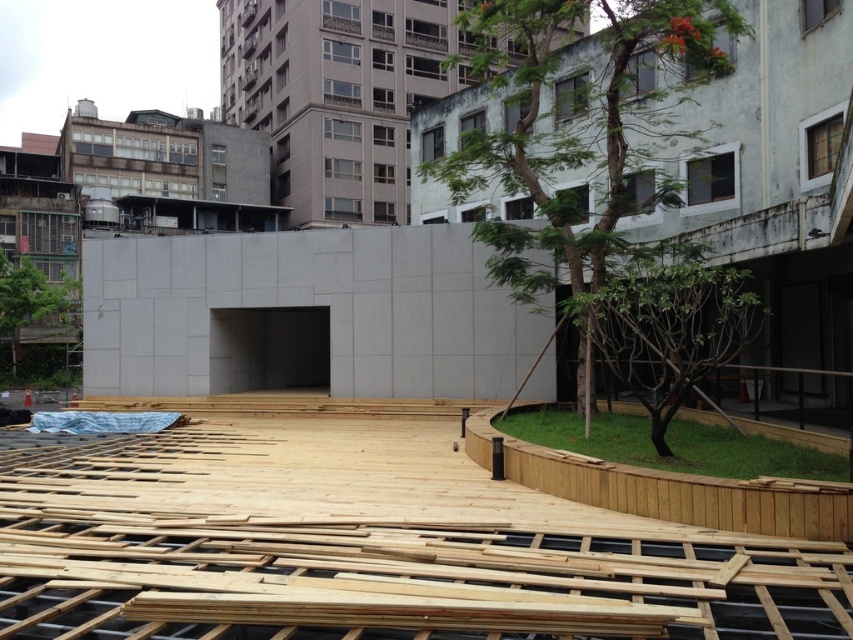
You are a delivery person trying to navigate through the construction site. You need to deliver a package to the entrance behind the large gray concrete wall. The entrance is through the rectangular opening in the wall. There are natural wood planks at center and a green leafy tree at center in your way. Which object should you move around to reach the entrance safely?

You should move around the green leafy tree at center because the natural wood planks at center are below it, so the tree is the one blocking your path to the entrance.